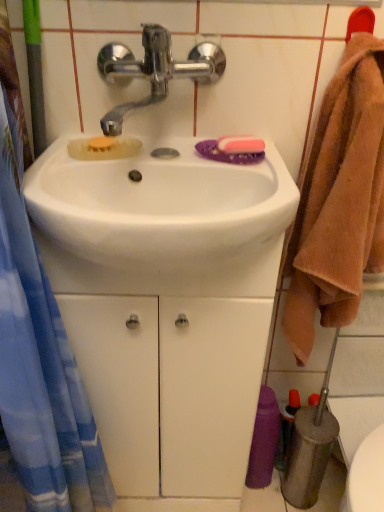
Question: Can you confirm if purple fabric towel at lower right is positioned to the left of white glossy sink at center?

Choices:
 (A) yes
 (B) no

Answer: (B)

Question: Considering the relative sizes of purple fabric towel at lower right and white glossy sink at center in the image provided, is purple fabric towel at lower right wider than white glossy sink at center?

Choices:
 (A) yes
 (B) no

Answer: (B)

Question: Is purple fabric towel at lower right not near white glossy sink at center?

Choices:
 (A) yes
 (B) no

Answer: (B)

Question: From the image's perspective, is purple fabric towel at lower right above white glossy sink at center?

Choices:
 (A) no
 (B) yes

Answer: (A)

Question: Could you tell me if purple fabric towel at lower right is turned towards white glossy sink at center?

Choices:
 (A) no
 (B) yes

Answer: (A)

Question: Based on their sizes in the image, would you say white glossy sink at center is bigger or smaller than white glossy cabinet at center?

Choices:
 (A) big
 (B) small

Answer: (B)

Question: Which is correct: white glossy sink at center is inside white glossy cabinet at center, or outside of it?

Choices:
 (A) outside
 (B) inside

Answer: (B)

Question: From the image's perspective, is white glossy sink at center located above or below white glossy cabinet at center?

Choices:
 (A) above
 (B) below

Answer: (A)

Question: From a real-world perspective, relative to white glossy cabinet at center, is white glossy sink at center vertically above or below?

Choices:
 (A) below
 (B) above

Answer: (B)

Question: Would you say shiny metallic faucet at upper center is to the left or to the right of white glossy sink at center in the picture?

Choices:
 (A) right
 (B) left

Answer: (B)

Question: Is shiny metallic faucet at upper center taller or shorter than white glossy sink at center?

Choices:
 (A) short
 (B) tall

Answer: (A)

Question: Is point (122, 60) positioned closer to the camera than point (266, 284)?

Choices:
 (A) closer
 (B) farther

Answer: (A)

Question: Looking at their shapes, would you say shiny metallic faucet at upper center is wider or thinner than white glossy sink at center?

Choices:
 (A) wide
 (B) thin

Answer: (B)

Question: Based on their sizes in the image, would you say brown fluffy towel at right is bigger or smaller than white glossy sink at center?

Choices:
 (A) small
 (B) big

Answer: (B)

Question: Is brown fluffy towel at right taller or shorter than white glossy sink at center?

Choices:
 (A) tall
 (B) short

Answer: (A)